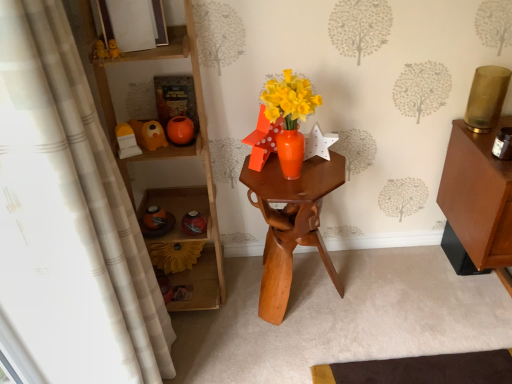
Question: From their relative heights in the image, would you say matte orange vase at center, arranged as the first toy when viewed from the back, is taller or shorter than white textured curtain at left?

Choices:
 (A) short
 (B) tall

Answer: (A)

Question: Would you say matte orange vase at center, the second toy from the front, is to the left or to the right of white textured curtain at left in the picture?

Choices:
 (A) right
 (B) left

Answer: (A)

Question: Estimate the real-world distances between objects in this image. Which object is farther from the wooden shelf at left?

Choices:
 (A) matte orange vase at center, arranged as the first toy when viewed from the back
 (B) white textured curtain at left
 (C) matte white picture frame at upper center
 (D) matte yellow plastic toy at left, positioned as the 1th toy in front-to-back order
 (E) wooden hexagonal table at center

Answer: (B)

Question: Based on their relative distances, which object is farther from the wooden hexagonal table at center?

Choices:
 (A) wooden shelf at left
 (B) matte white picture frame at upper center
 (C) matte orange vase at center, the second toy from the front
 (D) matte yellow plastic toy at left, which is the 2th toy in back-to-front order
 (E) white textured curtain at left

Answer: (B)